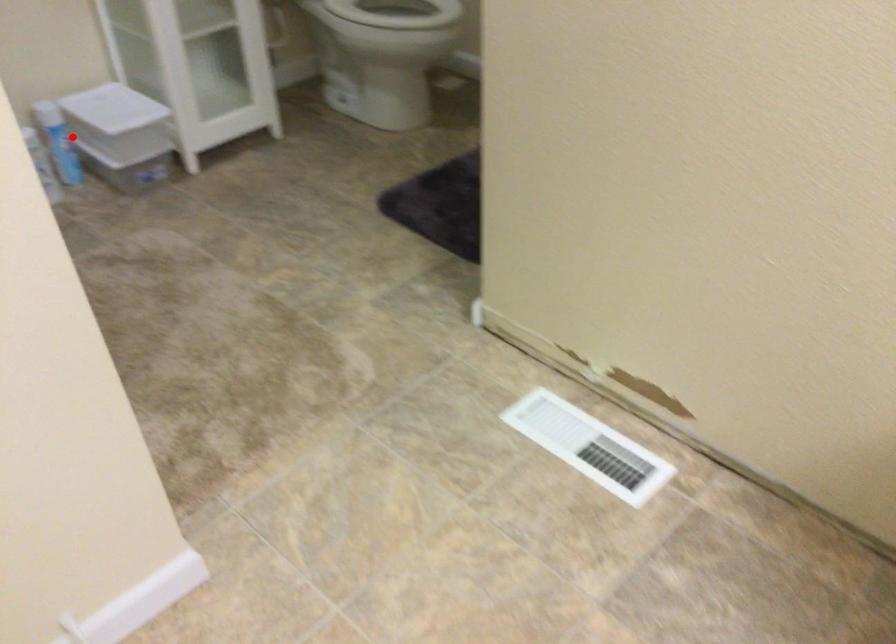
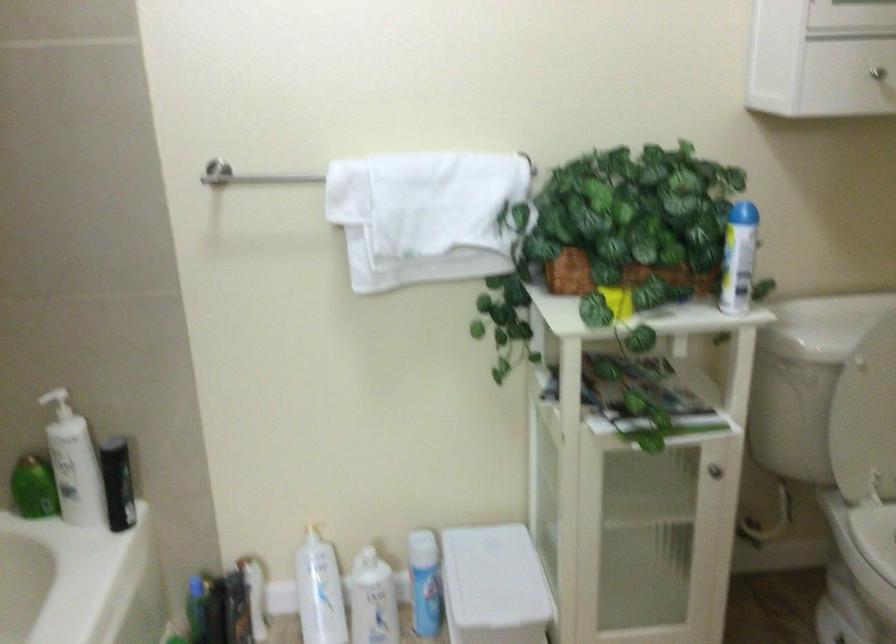
In the second image, find the point that corresponds to the highlighted location in the first image.

(424, 583)